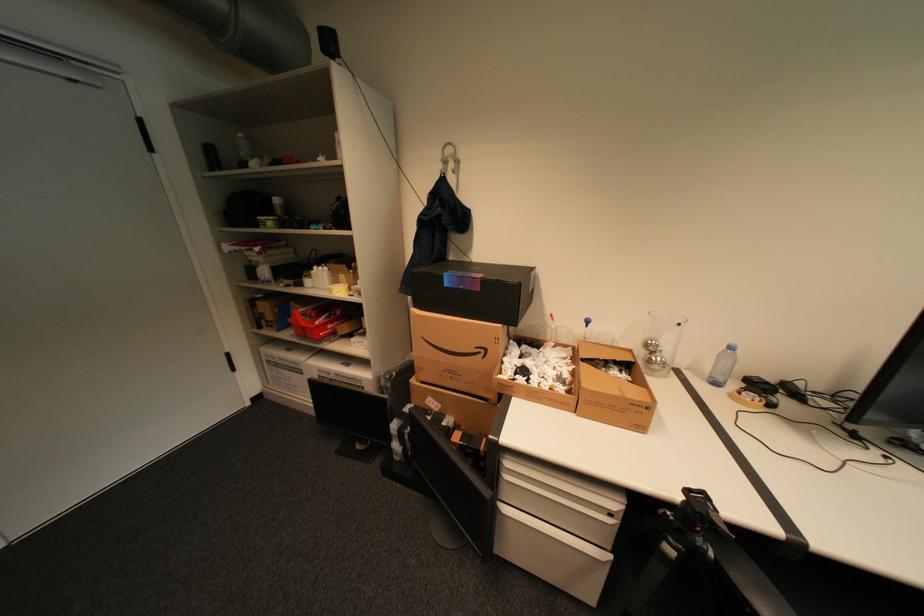
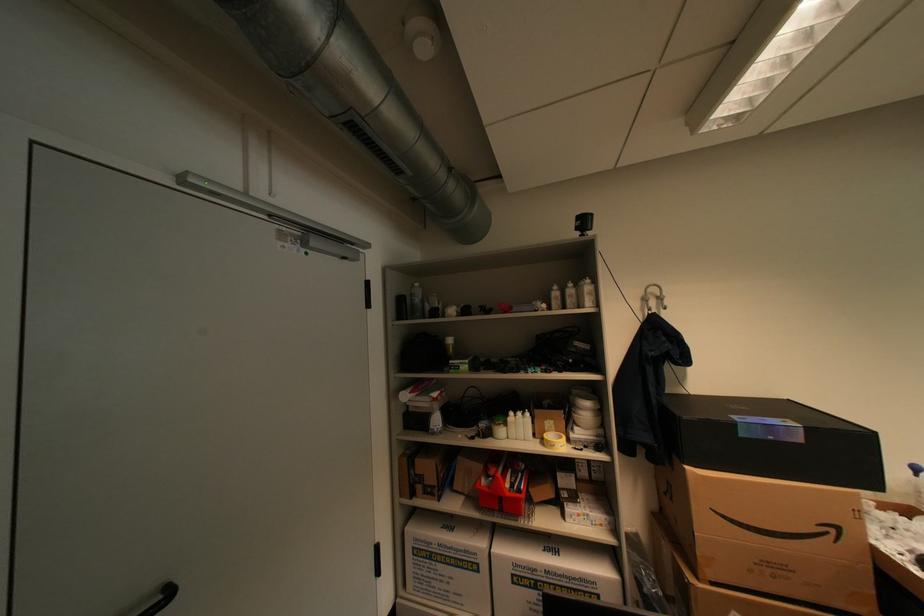
Find the pixel in the second image that matches the point at 323,268 in the first image.

(519, 414)